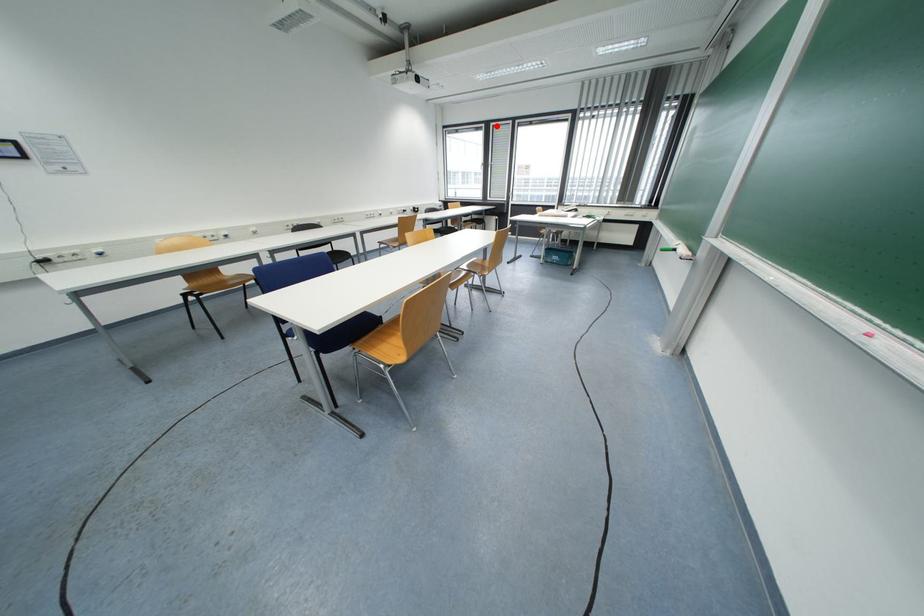
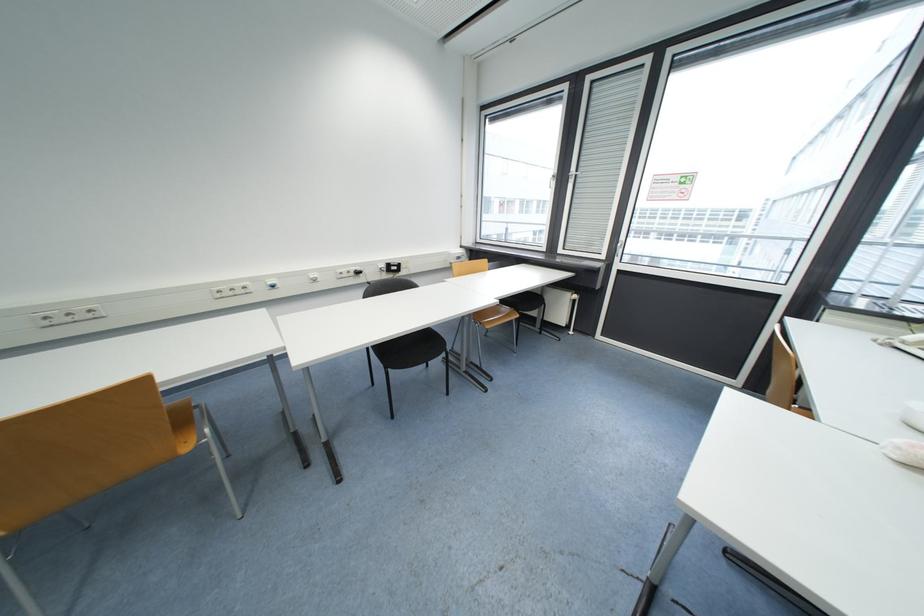
Locate, in the second image, the point that corresponds to the highlighted location in the first image.

(593, 81)